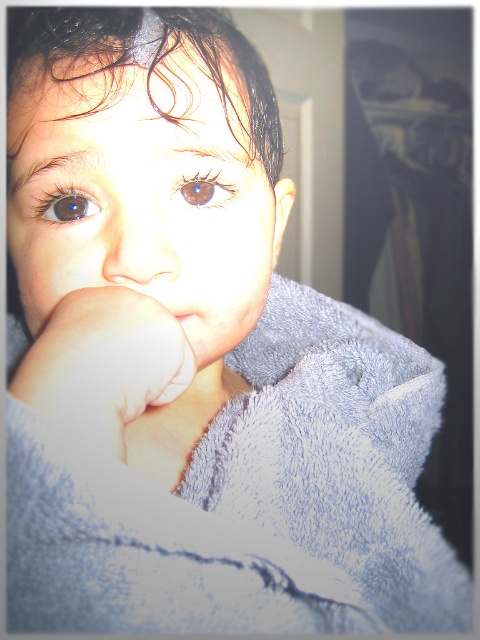
Based on the scene, which object is wider, the matte gray towel at center or the brown matte eye at center?

The matte gray towel at center is wider than the brown matte eye at center.

Looking at the image of the child in the blue towel, can you tell me which object is located below the other between the smooth flesh nose at center and the brown matte eye at center?

The smooth flesh nose at center is positioned under the brown matte eye at center, so the nose is below the eye.

You are a photographer adjusting your camera settings to focus on two specific points in the image. The first point is at coordinates point (93, 29) and the second is at point (135, 284). Which point should you focus on first if you want to ensure the closest object is sharp?

Point (93, 29) is closer to the camera than point (135, 284), so you should focus on point (93, 29) first to ensure the closest object is sharp.